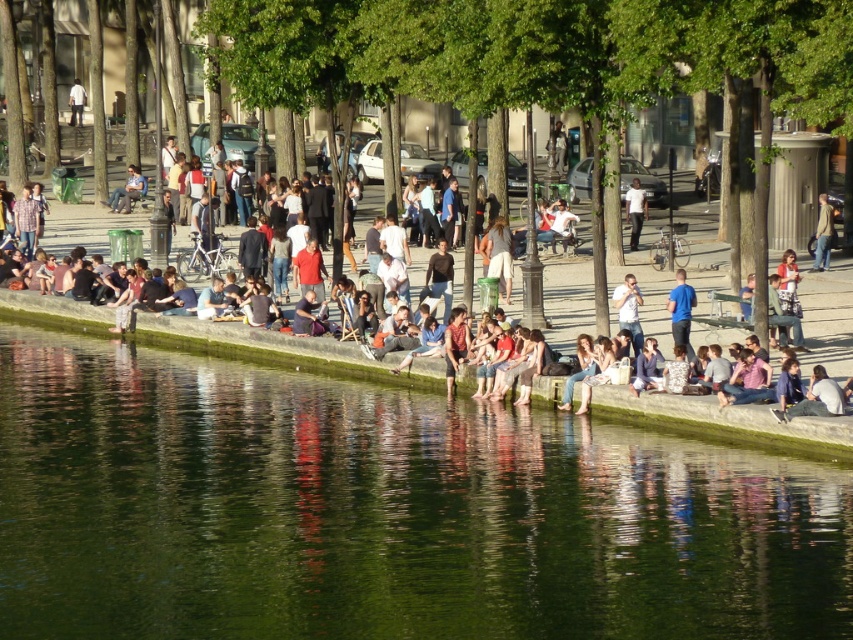
Is green smooth water at center shorter than light brown leather jacket at center?

No, green smooth water at center is not shorter than light brown leather jacket at center.

At what (x,y) coordinates should I click in order to perform the action: click on green smooth water at center. Please return your answer as a coordinate pair (x, y). Image resolution: width=853 pixels, height=640 pixels. Looking at the image, I should click on (383, 512).

Locate an element on the screen. This screenshot has height=640, width=853. matte black shirt at center is located at coordinates (630, 308).

Find the location of `matte black shirt at center`. matte black shirt at center is located at coordinates (630, 308).

Consider the image. Does light blue denim jeans at lower right come in front of light brown leather jacket at center?

That is True.

Does point (830, 404) come behind point (827, 260)?

No, (830, 404) is closer to viewer.

Who is more distant from viewer, (778, 417) or (817, 253)?

The point (817, 253) is more distant.

This screenshot has height=640, width=853. Find the location of `light blue denim jeans at lower right`. light blue denim jeans at lower right is located at coordinates (816, 397).